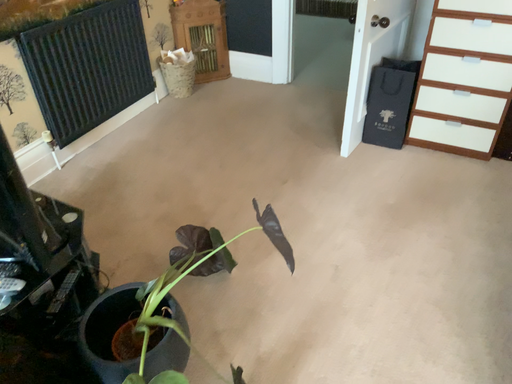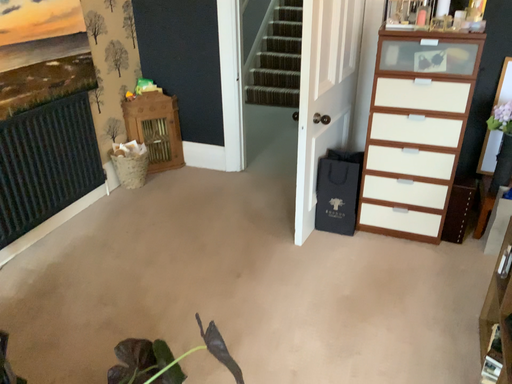
Question: Which way did the camera rotate in the video?

Choices:
 (A) rotated downward
 (B) rotated upward

Answer: (B)